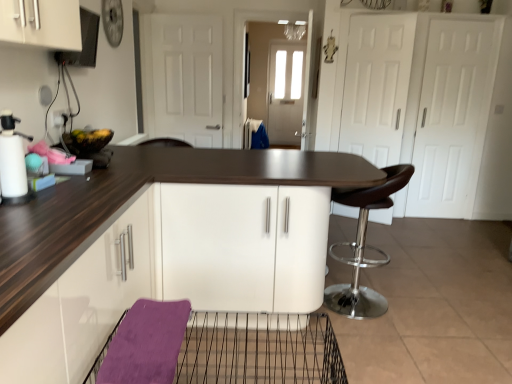
Where is `free point above white matte door at center (from a real-world perspective)`? free point above white matte door at center (from a real-world perspective) is located at coordinates (190, 10).